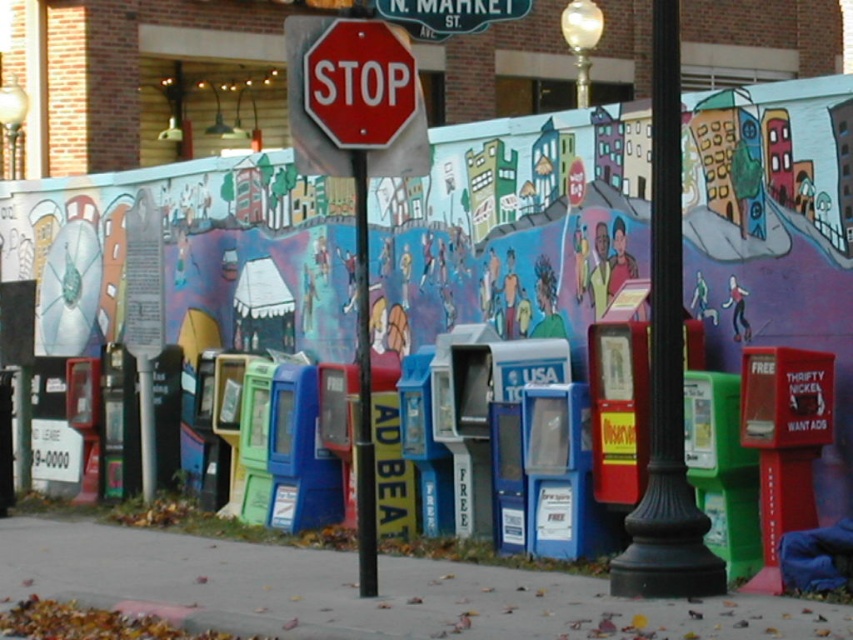
You are a delivery driver who needs to park your car between the black polished pole at center and the red matte stop sign at center. Given that your car is 2 meters long, can you fit your car in the space between them?

The black polished pole at center has a larger size compared to red matte stop sign at center, but the distance between them is not provided. Without knowing the exact distance, it is impossible to determine if the car can fit.

You are a city planner reviewing the layout of the urban scene. You notice two poles at the center area. Which one is wider between the black polished pole at center and the black metal pole at center?

The black polished pole at center is wider than the black metal pole at center according to the description.